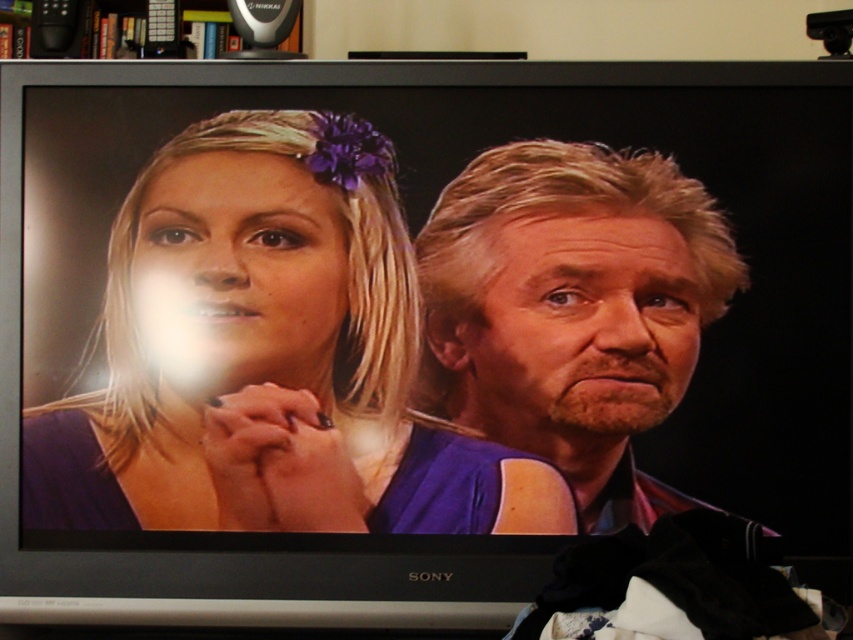
You are an interior designer assessing the TV screen layout. The TV shows a woman with a purple matte hair clip at center and a wooden bookshelf at upper center. Which object on the TV screen appears larger in height?

The purple matte hair clip at center appears taller than the wooden bookshelf at upper center on the TV screen.

You are an interior designer assessing the layout of a living room. You notice the blonde hair at right and the wooden bookshelf at upper center. Based on their widths, which object would you consider to be more compact in size?

The blonde hair at right has a lesser width compared to the wooden bookshelf at upper center, so it is more compact in size.

You are a graphic designer working on a project that requires precise placement of elements. You need to position a new icon exactly 0.1 units to the right of the purple matte hair clip at center. What are the coordinates where you should place the new icon?

The purple matte hair clip at center is located at point (270, 356). To place the new icon 0.1 units to the right, add 0.1 to the x coordinate, resulting in coordinates (270, 420).